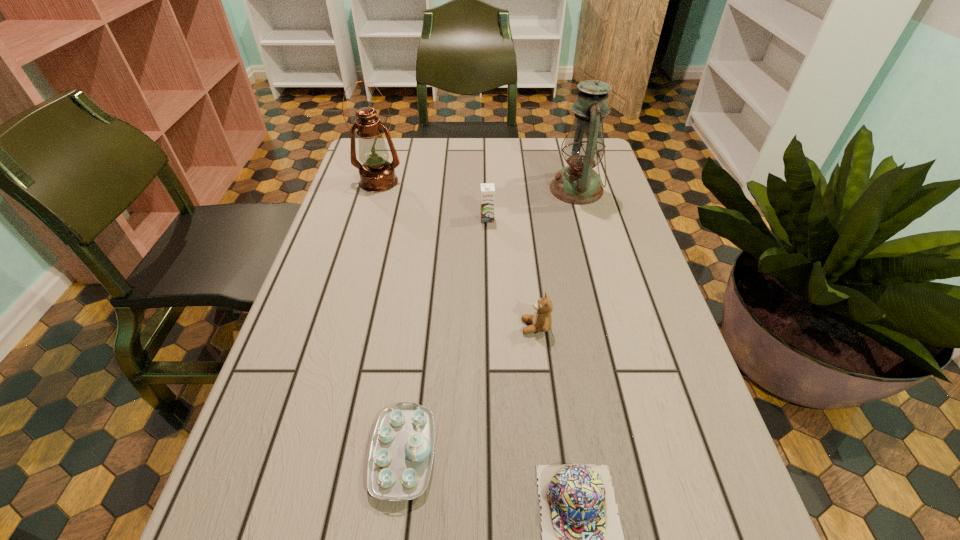
Identify the location of the right oil lamp. The image size is (960, 540). (578, 183).

The height and width of the screenshot is (540, 960). Find the location of `the left oil lamp`. the left oil lamp is located at coordinates (377, 174).

At what (x,y) coordinates should I click in order to perform the action: click on the fourth nearest object. Please return your answer as a coordinate pair (x, y). Looking at the image, I should click on (487, 189).

Where is `the fourth object from right to left`? the fourth object from right to left is located at coordinates (487, 189).

The height and width of the screenshot is (540, 960). I want to click on teddy bear, so click(x=541, y=321).

At what (x,y) coordinates should I click in order to perform the action: click on the fourth farthest object. Please return your answer as a coordinate pair (x, y). The height and width of the screenshot is (540, 960). Looking at the image, I should click on (541, 321).

Image resolution: width=960 pixels, height=540 pixels. Find the location of `chinaware`. chinaware is located at coordinates (400, 460).

This screenshot has height=540, width=960. Find the location of `vacant region located on the left of the right oil lamp`. vacant region located on the left of the right oil lamp is located at coordinates (468, 189).

I want to click on vacant space located on the front of the left oil lamp, so coord(347,291).

The image size is (960, 540). What are the coordinates of `free location located 0.330m on the front of the fourth nearest object` in the screenshot? It's located at (490, 318).